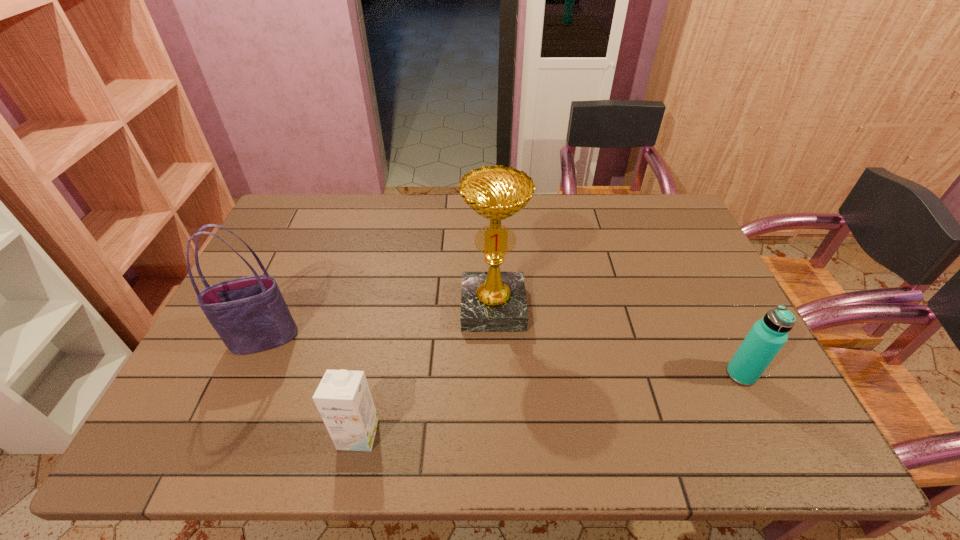
Find the location of a particular element. The height and width of the screenshot is (540, 960). award is located at coordinates (493, 301).

At what (x,y) coordinates should I click in order to perform the action: click on the leftmost object. Please return your answer as a coordinate pair (x, y). The height and width of the screenshot is (540, 960). Looking at the image, I should click on (250, 315).

Image resolution: width=960 pixels, height=540 pixels. Find the location of `water bottle`. water bottle is located at coordinates click(767, 336).

The image size is (960, 540). I want to click on the rightmost object, so click(x=767, y=336).

Identify the location of carton. (343, 398).

In order to click on the nearest object in this screenshot , I will do `click(343, 398)`.

What are the coordinates of `vacant space situated on the front-facing side of the third object from left to right` in the screenshot? It's located at (495, 396).

Where is `vacant space located 0.120m on the front of the leftmost object`? The image size is (960, 540). vacant space located 0.120m on the front of the leftmost object is located at coordinates (237, 399).

Image resolution: width=960 pixels, height=540 pixels. Identify the location of free space located 0.230m on the back of the rightmost object. (702, 295).

You are a GUI agent. You are given a task and a screenshot of the screen. Output one action in this format:
    pyautogui.click(x=<x>, y=<y>)
    Task: Click on the vacant region located 0.390m on the right of the carton
    The width and height of the screenshot is (960, 540).
    Given the screenshot: What is the action you would take?
    pyautogui.click(x=556, y=434)